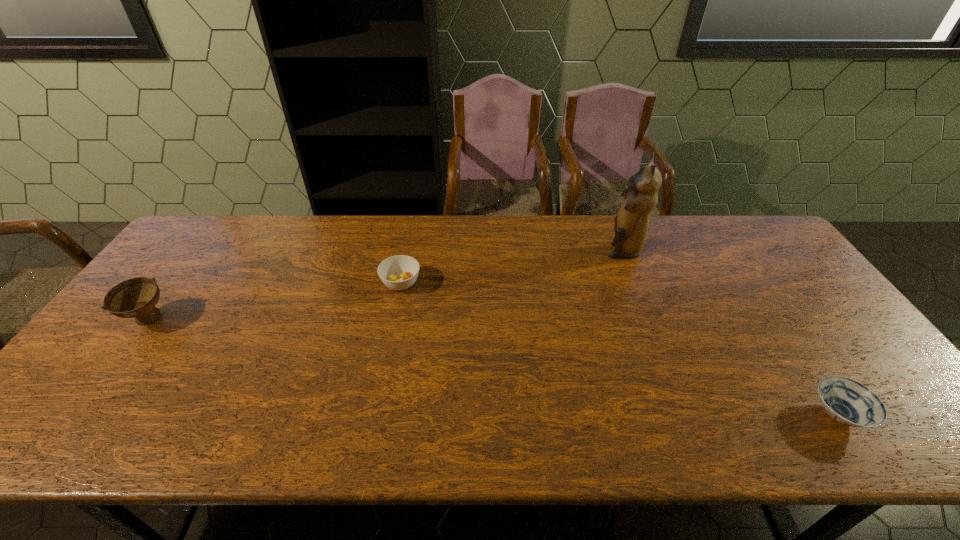
At what (x,y) coordinates should I click in order to perform the action: click on vacant space that satisfies the following two spatial constraints: 1. on the face of the nearest object; 2. on the left side of the cat. Please return your answer as a coordinate pair (x, y). This screenshot has height=540, width=960. Looking at the image, I should click on (687, 415).